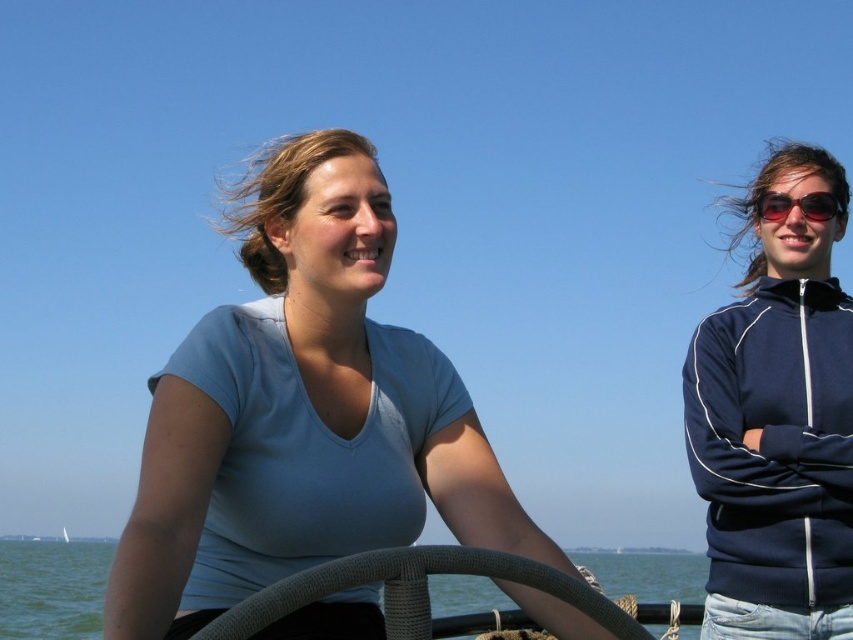
Question: Which point appears closest to the camera in this image?

Choices:
 (A) (779, 192)
 (B) (807, 529)

Answer: (B)

Question: Estimate the real-world distances between objects in this image. Which object is closer to the white woven steering wheel at center?

Choices:
 (A) sunglasses at right
 (B) matte blue shirt at center

Answer: (A)

Question: Is navy blue zip-up jacket at upper right further to the viewer compared to white woven steering wheel at center?

Choices:
 (A) no
 (B) yes

Answer: (A)

Question: Which of the following is the closest to the observer?

Choices:
 (A) textured grey steering wheel at center
 (B) white woven steering wheel at center
 (C) navy blue zip-up jacket at upper right
 (D) matte blue shirt at center

Answer: (A)

Question: In this image, where is sunglasses at right located relative to white woven steering wheel at center?

Choices:
 (A) below
 (B) above

Answer: (B)

Question: Is sunglasses at right wider than white woven steering wheel at center?

Choices:
 (A) no
 (B) yes

Answer: (A)